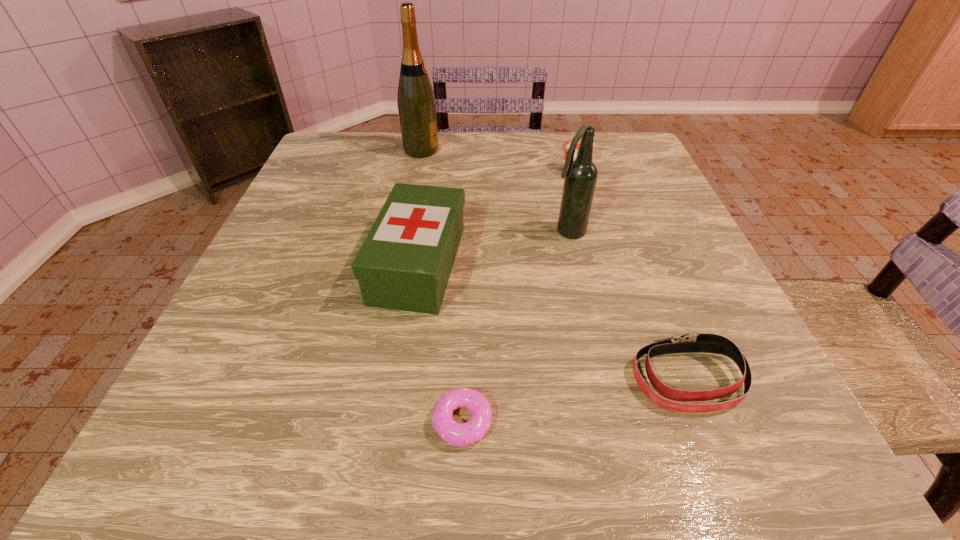
Where is `the tallest object`? This screenshot has height=540, width=960. the tallest object is located at coordinates (416, 102).

Identify the location of wine bottle. Image resolution: width=960 pixels, height=540 pixels. pos(416,102).

Identify the location of beer bottle. (581, 174).

Image resolution: width=960 pixels, height=540 pixels. Find the location of `the first-aid kit`. the first-aid kit is located at coordinates (405, 261).

Identify the location of the fifth nearest object. (566, 144).

This screenshot has height=540, width=960. I want to click on the fifth tallest object, so click(690, 342).

Find the location of a particular element. Image resolution: width=960 pixels, height=540 pixels. the shortest object is located at coordinates (456, 434).

This screenshot has height=540, width=960. I want to click on free space located 0.230m on the front-facing side of the farthest object, so click(524, 150).

Locate an element on the screen. This screenshot has height=540, width=960. free space located on the left of the second tallest object is located at coordinates (446, 232).

Identify the location of vacant region located 0.220m on the back of the first-aid kit. (433, 170).